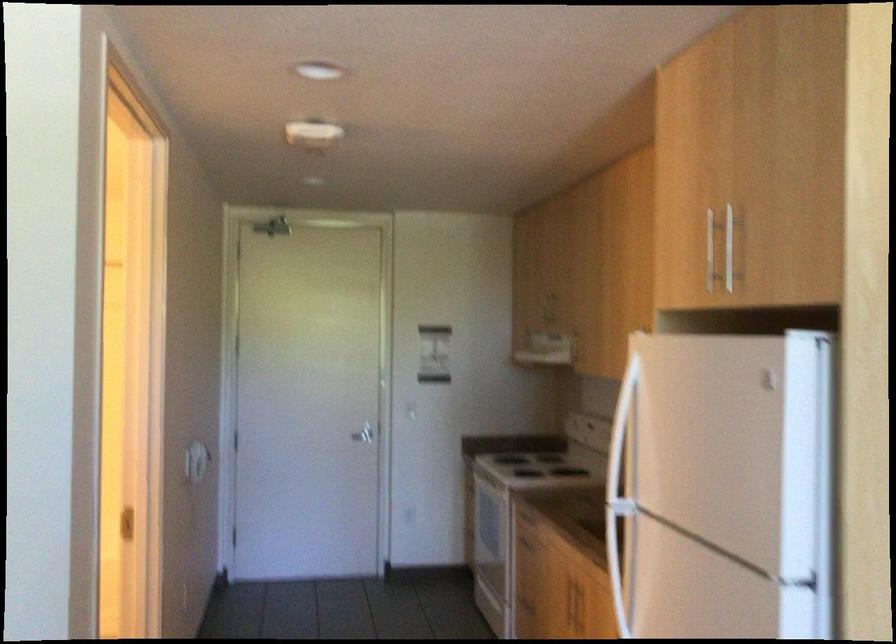
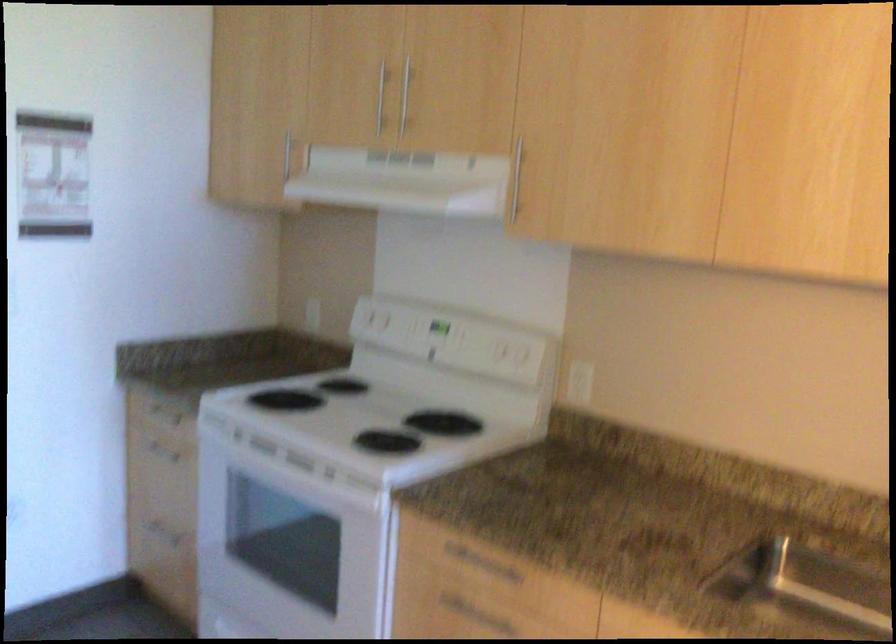
Find the pixel in the second image that matches point (538, 502) in the first image.

(480, 564)